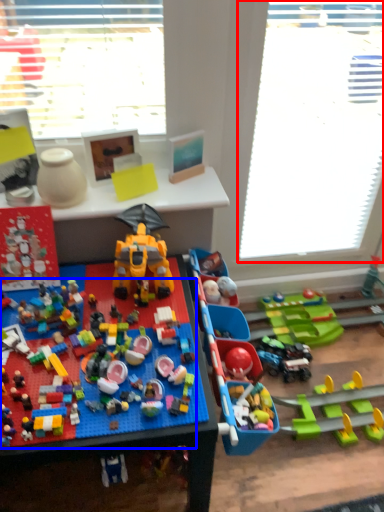
Question: Which of the following is the farthest to the observer, window screen (highlighted by a red box) or toy (highlighted by a blue box)?

Choices:
 (A) window screen
 (B) toy

Answer: (A)